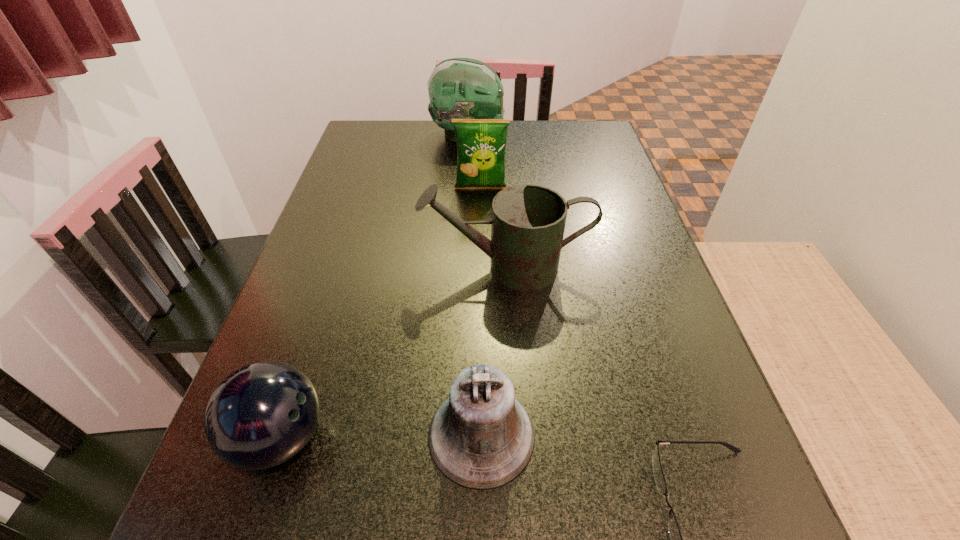
At what (x,y) coordinates should I click in order to perform the action: click on vacant position located 0.110m on the right of the bell. Please return your answer as a coordinate pair (x, y). The image size is (960, 540). Looking at the image, I should click on (606, 435).

Where is `vacant area located on the side of the bowling ball with the finger holes`? This screenshot has width=960, height=540. vacant area located on the side of the bowling ball with the finger holes is located at coordinates (368, 437).

In order to click on object at the far edge in this screenshot , I will do `click(459, 88)`.

The image size is (960, 540). What are the coordinates of `object situated at the left edge` in the screenshot? It's located at [x=260, y=416].

What are the coordinates of `object present at the right edge` in the screenshot? It's located at (528, 221).

Image resolution: width=960 pixels, height=540 pixels. I want to click on vacant space at the far edge, so click(x=419, y=142).

The image size is (960, 540). I want to click on free space at the left edge of the desktop, so click(x=362, y=223).

This screenshot has width=960, height=540. I want to click on vacant area at the right edge, so (x=636, y=319).

In the image, there is a desktop. What are the coordinates of `vacant space at the far right corner` in the screenshot? It's located at (602, 129).

Find the location of a particular element. The height and width of the screenshot is (540, 960). vacant region between the bell and the bowling ball is located at coordinates (381, 436).